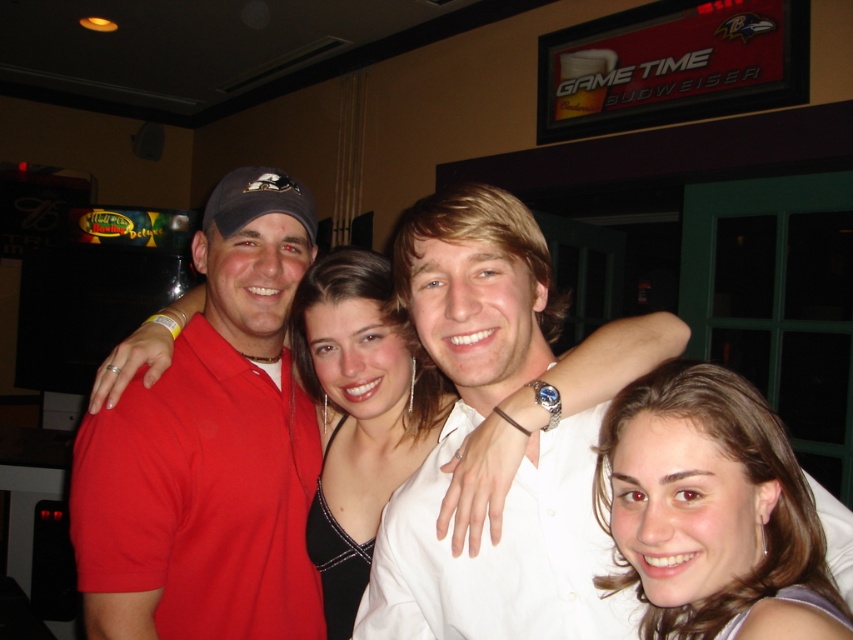
Question: Estimate the real-world distances between objects in this image. Which object is closer to the matte red polo shirt at center?

Choices:
 (A) white smooth shirt at center
 (B) satin black dress at center

Answer: (B)

Question: Among these points, which one is farthest from the camera?

Choices:
 (A) (547, 625)
 (B) (376, 262)

Answer: (B)

Question: Which point appears farthest from the camera in this image?

Choices:
 (A) (273, 616)
 (B) (753, 451)

Answer: (A)

Question: Where is matte red polo shirt at center located in relation to white smooth shirt at center in the image?

Choices:
 (A) right
 (B) left

Answer: (B)

Question: Does white smooth shirt at center appear on the right side of satin black dress at center?

Choices:
 (A) yes
 (B) no

Answer: (A)

Question: Does white smooth shirt at center appear on the left side of satin black dress at center?

Choices:
 (A) no
 (B) yes

Answer: (A)